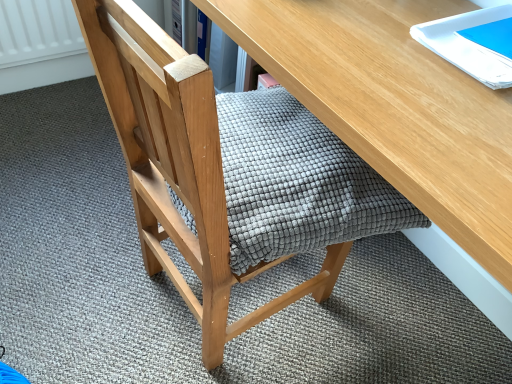
You are a GUI agent. You are given a task and a screenshot of the screen. Output one action in this format:
    pyautogui.click(x=<x>, y=<y>)
    Task: Click on the vacant area to the left of textured gray cushion at center
    The image size is (512, 384).
    Given the screenshot: What is the action you would take?
    pyautogui.click(x=75, y=261)